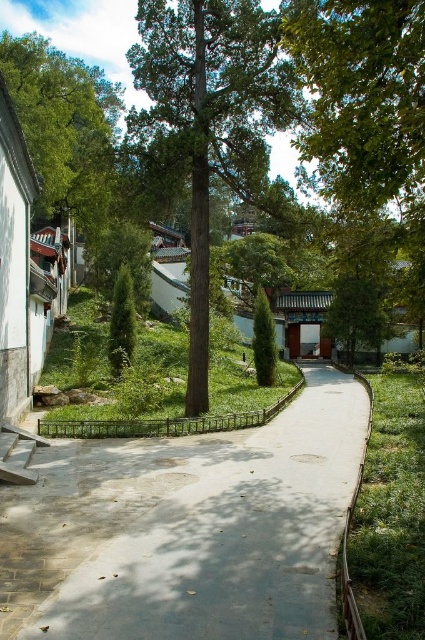
You are a gardener who needs to water the green textured tree at center. You are currently standing on the gray concrete pavement at center. Which direction should you move to reach the tree?

The gray concrete pavement at center is positioned on the right side of green textured tree at center. To reach the tree, you should move to the left from the gray concrete pavement at center.